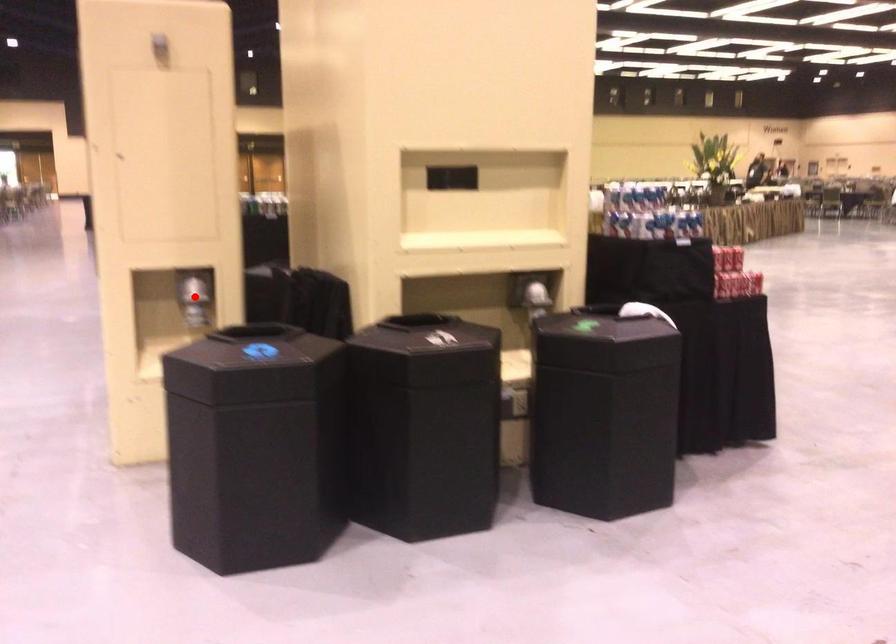
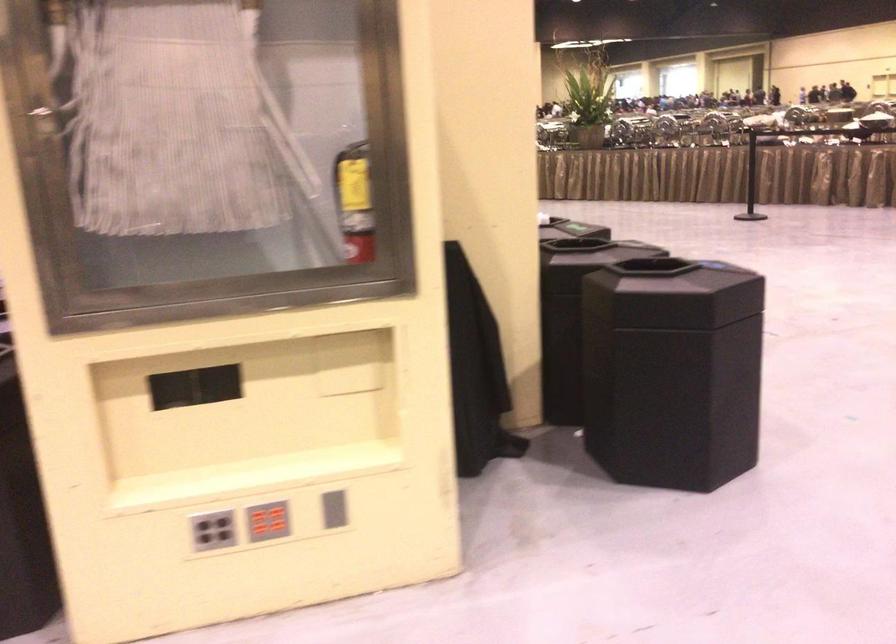
Question: I am providing you with two images of the same scene from different viewpoints. A red point is marked on the first image. Is the red point's position out of view in image 2?

Choices:
 (A) Yes
 (B) No

Answer: (A)